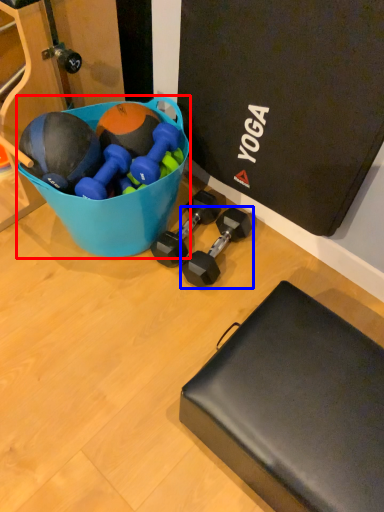
Question: Among these objects, which one is nearest to the camera, bowl (highlighted by a red box) or dumbbell (highlighted by a blue box)?

Choices:
 (A) bowl
 (B) dumbbell

Answer: (A)